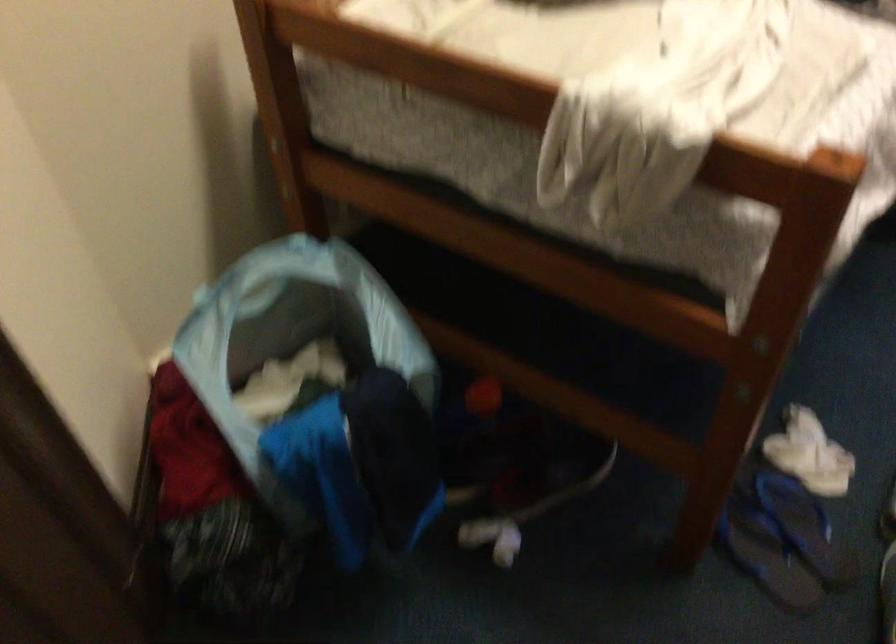
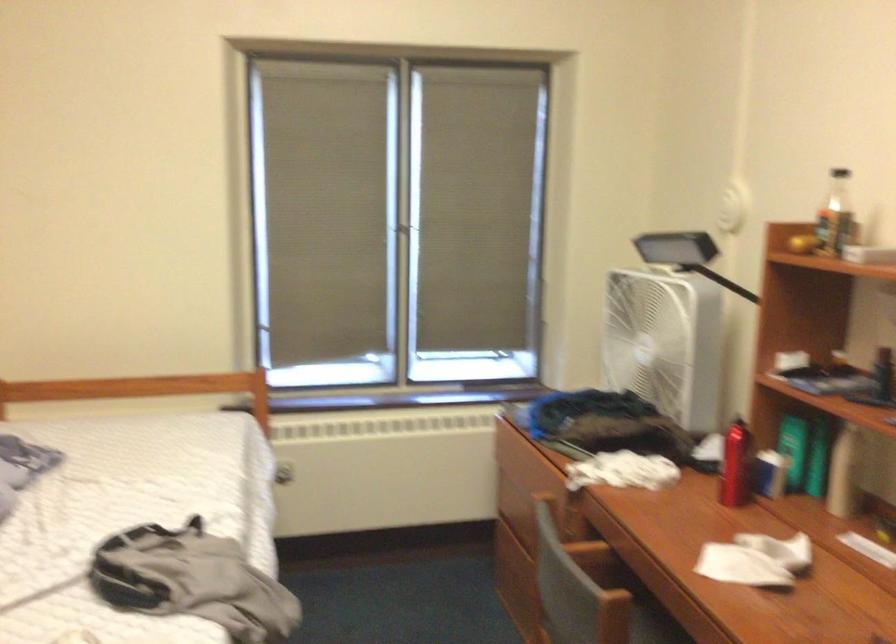
First-person continuous shooting, in which direction is the camera rotating?

The camera rotated toward right-up.